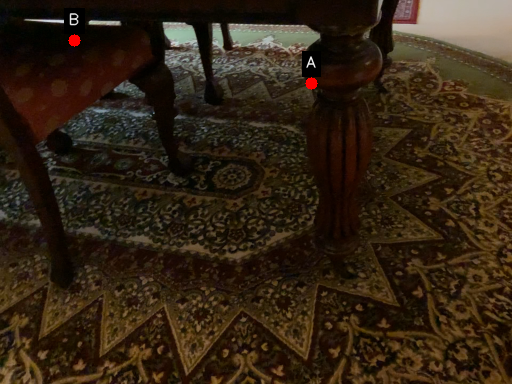
Question: Two points are circled on the image, labeled by A and B beside each circle. Which of the following is the closest to the observer?

Choices:
 (A) A is closer
 (B) B is closer

Answer: (A)